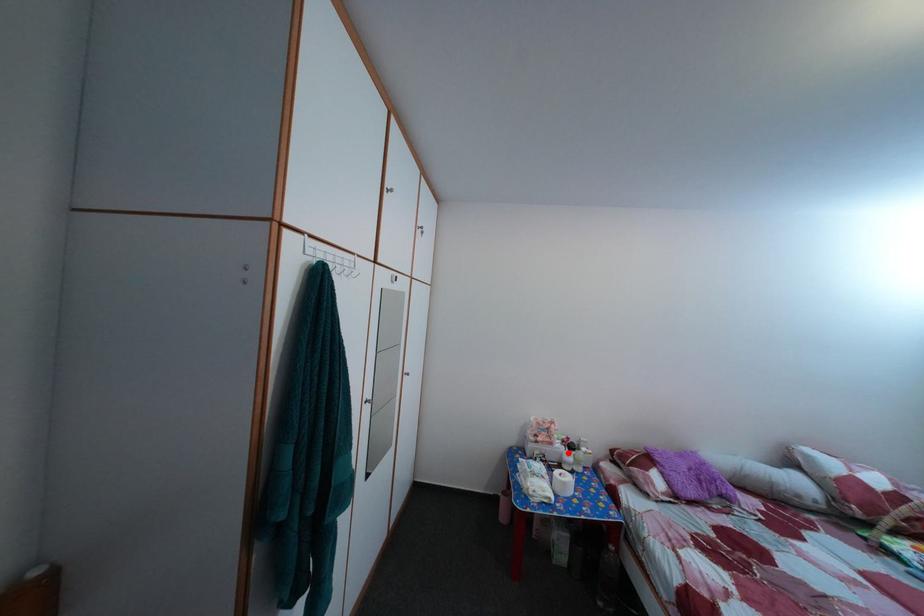
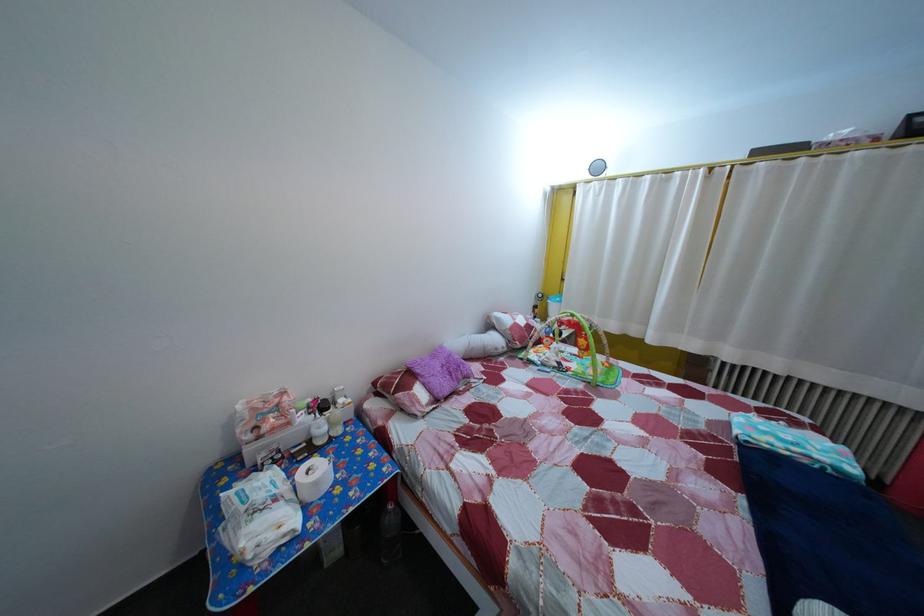
In the second image, find the point that corresponds to the highlighted location in the first image.

(311, 427)